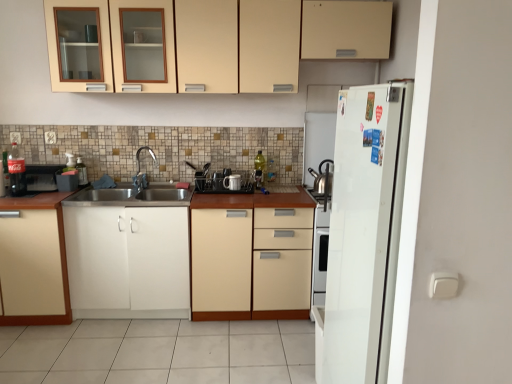
You are a GUI agent. You are given a task and a screenshot of the screen. Output one action in this format:
    pyautogui.click(x=<x>, y=<y>)
    Task: Click on the free space above beige wood cabinet at center, the first cabinetry positioned from the right (from a real-world perspective)
    
    Given the screenshot: What is the action you would take?
    pyautogui.click(x=249, y=196)